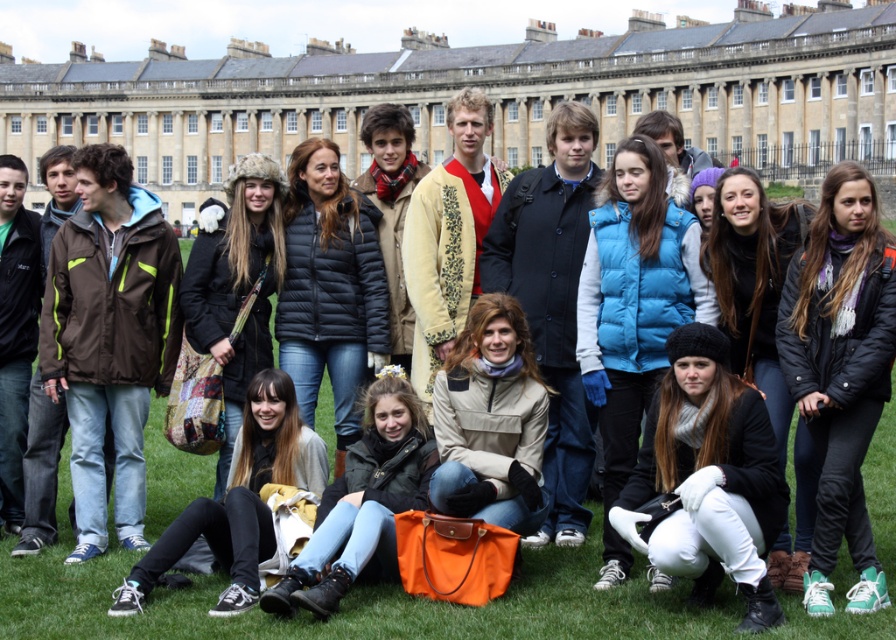
Does black fuzzy hat at upper center have a greater height compared to tan fabric jacket at center?

Yes, black fuzzy hat at upper center is taller than tan fabric jacket at center.

Which is in front, point (847, 164) or point (507, 428)?

Point (847, 164) is more forward.

Image resolution: width=896 pixels, height=640 pixels. I want to click on black fuzzy hat at upper center, so click(841, 371).

Is smooth stone palace at center positioned at the back of tan fabric jacket at center?

Yes, smooth stone palace at center is behind tan fabric jacket at center.

Between point (544, 77) and point (474, 317), which one is positioned behind?

Point (544, 77)

The image size is (896, 640). In order to click on smooth stone palace at center in this screenshot , I will do `click(484, 90)`.

Based on the photo, is smooth stone palace at center smaller than matte yellow jacket at lower center?

No.

Is smooth stone palace at center in front of matte yellow jacket at lower center?

No.

Who is more distant from viewer, [696,67] or [152,557]?

The point [696,67] is behind.

Where is `smooth stone palace at center`? The height and width of the screenshot is (640, 896). smooth stone palace at center is located at coordinates (484, 90).